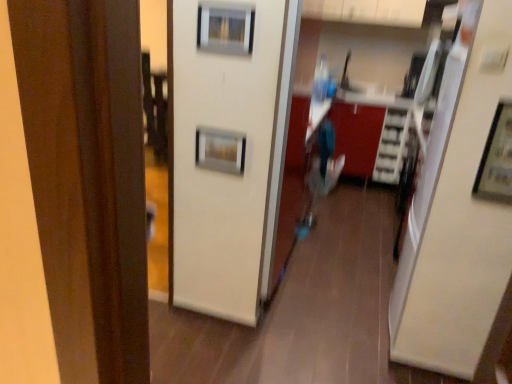
This screenshot has width=512, height=384. What do you see at coordinates (367, 11) in the screenshot?
I see `white glossy cabinet at upper center` at bounding box center [367, 11].

This screenshot has height=384, width=512. What do you see at coordinates (497, 158) in the screenshot?
I see `metallic silver picture frame at upper right, which is the first picture frame from bottom to top` at bounding box center [497, 158].

Where is `metallic silver picture frame at center, the third picture frame viewed from the right`? The width and height of the screenshot is (512, 384). metallic silver picture frame at center, the third picture frame viewed from the right is located at coordinates pyautogui.click(x=220, y=150).

What do you see at coordinates (220, 150) in the screenshot? I see `metallic silver picture frame at center, the second picture frame in the bottom-to-top sequence` at bounding box center [220, 150].

Based on the photo, in order to face metallic silver picture frame at upper center, which ranks as the first picture frame in top-to-bottom order, should I rotate leftwards or rightwards?

It's best to rotate left around 4.050 degrees.

The width and height of the screenshot is (512, 384). I want to click on white glossy cabinet at upper center, so [x=367, y=11].

Based on the photo, looking at their sizes, would you say metallic silver picture frame at upper right, the first picture frame in the front-to-back sequence, is wider or thinner than white glossy cabinet at upper center?

Clearly, metallic silver picture frame at upper right, the first picture frame in the front-to-back sequence, has less width compared to white glossy cabinet at upper center.

Choose the correct answer: Is metallic silver picture frame at upper right, the first picture frame in the front-to-back sequence, inside white glossy cabinet at upper center or outside it?

metallic silver picture frame at upper right, the first picture frame in the front-to-back sequence, is spatially situated outside white glossy cabinet at upper center.

Consider the image. How much distance is there between metallic silver picture frame at upper right, the third picture frame positioned from the back, and white glossy cabinet at upper center?

The distance of metallic silver picture frame at upper right, the third picture frame positioned from the back, from white glossy cabinet at upper center is 2.46 meters.

Is metallic silver picture frame at upper center, the second picture frame in the left-to-right sequence, beside metallic silver picture frame at upper right, which is the 3th picture frame in left-to-right order?

No, metallic silver picture frame at upper center, the second picture frame in the left-to-right sequence, is not next to metallic silver picture frame at upper right, which is the 3th picture frame in left-to-right order.

Considering the sizes of objects metallic silver picture frame at upper center, the 2th picture frame when ordered from front to back, and metallic silver picture frame at upper right, which is the first picture frame from bottom to top, in the image provided, who is thinner, metallic silver picture frame at upper center, the 2th picture frame when ordered from front to back, or metallic silver picture frame at upper right, which is the first picture frame from bottom to top,?

Thinner between the two is metallic silver picture frame at upper center, the 2th picture frame when ordered from front to back.

Based on the photo, is metallic silver picture frame at upper center, the second picture frame in the left-to-right sequence, aimed at metallic silver picture frame at upper right, the third picture frame positioned from the back?

No, metallic silver picture frame at upper center, the second picture frame in the left-to-right sequence, is not facing towards metallic silver picture frame at upper right, the third picture frame positioned from the back.

Relative to metallic silver picture frame at upper right, which is the first picture frame from bottom to top, is metallic silver picture frame at upper center, placed as the 2th picture frame when sorted from right to left, in front or behind?

Clearly, metallic silver picture frame at upper center, placed as the 2th picture frame when sorted from right to left, is behind metallic silver picture frame at upper right, which is the first picture frame from bottom to top.

How many degrees apart are the facing directions of metallic silver picture frame at upper center, the 2th picture frame when ordered from front to back, and white glossy cabinet at upper center?

The angular difference between metallic silver picture frame at upper center, the 2th picture frame when ordered from front to back, and white glossy cabinet at upper center is 1.66 degrees.

Could you tell me if metallic silver picture frame at upper center, placed as the 2th picture frame when sorted from right to left, is turned towards white glossy cabinet at upper center?

No, metallic silver picture frame at upper center, placed as the 2th picture frame when sorted from right to left, is not facing towards white glossy cabinet at upper center.

Do you think metallic silver picture frame at upper center, which ranks as the first picture frame in top-to-bottom order, is within white glossy cabinet at upper center, or outside of it?

metallic silver picture frame at upper center, which ranks as the first picture frame in top-to-bottom order, is outside white glossy cabinet at upper center.

Considering the points (219, 46) and (367, 17), which point is in front, point (219, 46) or point (367, 17)?

The point (219, 46) is closer.

From the image's perspective, which object appears higher, white glossy cabinet at upper center or metallic silver picture frame at center, the second picture frame in the bottom-to-top sequence?

From the image's view, white glossy cabinet at upper center is above.

Which of these two, white glossy cabinet at upper center or metallic silver picture frame at center, the 3th picture frame viewed from the front, is thinner?

Thinner between the two is metallic silver picture frame at center, the 3th picture frame viewed from the front.

In terms of size, does white glossy cabinet at upper center appear bigger or smaller than metallic silver picture frame at center, the second picture frame in the bottom-to-top sequence?

In the image, white glossy cabinet at upper center appears to be larger than metallic silver picture frame at center, the second picture frame in the bottom-to-top sequence.

Locate an element on the screen. The width and height of the screenshot is (512, 384). cabinetry above the metallic silver picture frame at center, the third picture frame viewed from the right (from the image's perspective) is located at coordinates (367, 11).

Considering the positions of points (486, 191) and (244, 163), is point (486, 191) farther from camera compared to point (244, 163)?

No.

Is metallic silver picture frame at upper right, the first picture frame in the front-to-back sequence, looking in the opposite direction of metallic silver picture frame at center, the second picture frame in the bottom-to-top sequence?

No, metallic silver picture frame at upper right, the first picture frame in the front-to-back sequence, is not facing away from metallic silver picture frame at center, the second picture frame in the bottom-to-top sequence.

From the image's perspective, does metallic silver picture frame at upper right, which is the first picture frame from bottom to top, appear lower than metallic silver picture frame at center, the second picture frame in the bottom-to-top sequence?

Answer: Yes.

Considering their positions, is white glossy cabinet at upper center located in front of or behind metallic silver picture frame at upper center, placed as the second picture frame when sorted from back to front?

white glossy cabinet at upper center is behind metallic silver picture frame at upper center, placed as the second picture frame when sorted from back to front.

From a real-world perspective, is white glossy cabinet at upper center physically located above or below metallic silver picture frame at upper center, placed as the 2th picture frame when sorted from right to left?

In terms of real-world spatial position, white glossy cabinet at upper center is above metallic silver picture frame at upper center, placed as the 2th picture frame when sorted from right to left.

Between white glossy cabinet at upper center and metallic silver picture frame at upper center, placed as the 2th picture frame when sorted from right to left, which one has larger size?

white glossy cabinet at upper center.

Between metallic silver picture frame at upper center, the 3th picture frame in the bottom-to-top sequence, and metallic silver picture frame at center, the third picture frame viewed from the right, which one has smaller width?

With smaller width is metallic silver picture frame at center, the third picture frame viewed from the right.

Is metallic silver picture frame at upper center, the 2th picture frame when ordered from front to back, oriented away from metallic silver picture frame at center, the 1th picture frame when ordered from left to right?

No, metallic silver picture frame at center, the 1th picture frame when ordered from left to right, is not at the back of metallic silver picture frame at upper center, the 2th picture frame when ordered from front to back.

Based on the photo, considering the positions of objects metallic silver picture frame at upper center, the 2th picture frame when ordered from front to back, and metallic silver picture frame at center, the second picture frame in the bottom-to-top sequence, in the image provided, who is more to the left, metallic silver picture frame at upper center, the 2th picture frame when ordered from front to back, or metallic silver picture frame at center, the second picture frame in the bottom-to-top sequence,?

Positioned to the left is metallic silver picture frame at center, the second picture frame in the bottom-to-top sequence.

Considering the relative positions of metallic silver picture frame at upper center, placed as the second picture frame when sorted from back to front, and metallic silver picture frame at center, which is counted as the first picture frame, starting from the back, in the image provided, is metallic silver picture frame at upper center, placed as the second picture frame when sorted from back to front, in front of metallic silver picture frame at center, which is counted as the first picture frame, starting from the back,?

Yes, the depth of metallic silver picture frame at upper center, placed as the second picture frame when sorted from back to front, is less than that of metallic silver picture frame at center, which is counted as the first picture frame, starting from the back.

Which picture frame is the 1st one when counting from the left side of the white glossy cabinet at upper center? Please provide its 2D coordinates.

[(497, 158)]

From the image's perspective, starting from the metallic silver picture frame at upper center, the 3th picture frame in the bottom-to-top sequence, which picture frame is the 2nd one below? Please provide its 2D coordinates.

[(497, 158)]

When comparing their distances from metallic silver picture frame at upper right, the first picture frame in the front-to-back sequence, does white glossy cabinet at upper center or metallic silver picture frame at upper center, the 3th picture frame in the bottom-to-top sequence, seem further?

The object further to metallic silver picture frame at upper right, the first picture frame in the front-to-back sequence, is white glossy cabinet at upper center.

Looking at the image, which one is located closer to metallic silver picture frame at center, the 1th picture frame when ordered from left to right, metallic silver picture frame at upper right, which is the first picture frame from bottom to top, or metallic silver picture frame at upper center, placed as the second picture frame when sorted from back to front?

metallic silver picture frame at upper center, placed as the second picture frame when sorted from back to front.

Estimate the real-world distances between objects in this image. Which object is further from metallic silver picture frame at upper center, which ranks as the first picture frame in top-to-bottom order, metallic silver picture frame at upper right, the 1th picture frame in the right-to-left sequence, or metallic silver picture frame at center, the second picture frame in the bottom-to-top sequence?

metallic silver picture frame at upper right, the 1th picture frame in the right-to-left sequence, is positioned further to the anchor metallic silver picture frame at upper center, which ranks as the first picture frame in top-to-bottom order.

Based on their spatial positions, is metallic silver picture frame at center, the 2th picture frame in the top-to-bottom sequence, or metallic silver picture frame at upper center, the 2th picture frame when ordered from front to back, closer to white glossy cabinet at upper center?

Based on the image, metallic silver picture frame at upper center, the 2th picture frame when ordered from front to back, appears to be nearer to white glossy cabinet at upper center.

When comparing their distances from metallic silver picture frame at center, the third picture frame viewed from the right, does metallic silver picture frame at upper center, the second picture frame in the left-to-right sequence, or metallic silver picture frame at upper right, which is the 3th picture frame in left-to-right order, seem further?

metallic silver picture frame at upper right, which is the 3th picture frame in left-to-right order, lies further to metallic silver picture frame at center, the third picture frame viewed from the right, than the other object.

Looking at this image, which object lies further to the anchor point metallic silver picture frame at upper center, the 3th picture frame in the bottom-to-top sequence, white glossy cabinet at upper center or metallic silver picture frame at center, the 2th picture frame in the top-to-bottom sequence?

Based on the image, white glossy cabinet at upper center appears to be further to metallic silver picture frame at upper center, the 3th picture frame in the bottom-to-top sequence.

Looking at the image, which one is located closer to metallic silver picture frame at upper center, which ranks as the first picture frame in top-to-bottom order, metallic silver picture frame at center, the 2th picture frame in the top-to-bottom sequence, or metallic silver picture frame at upper right, which is the 3th picture frame in left-to-right order?

metallic silver picture frame at center, the 2th picture frame in the top-to-bottom sequence, lies closer to metallic silver picture frame at upper center, which ranks as the first picture frame in top-to-bottom order, than the other object.

From the image, which object appears to be farther from metallic silver picture frame at upper right, which is the 3th picture frame in left-to-right order, metallic silver picture frame at center, the 2th picture frame in the top-to-bottom sequence, or white glossy cabinet at upper center?

The object further to metallic silver picture frame at upper right, which is the 3th picture frame in left-to-right order, is white glossy cabinet at upper center.

What are the coordinates of `picture frame between metallic silver picture frame at center, the 2th picture frame in the top-to-bottom sequence, and metallic silver picture frame at upper right, which is the 3th picture frame in left-to-right order` in the screenshot? It's located at (225, 29).

Where is `picture frame between metallic silver picture frame at upper center, placed as the second picture frame when sorted from back to front, and white glossy cabinet at upper center, along the z-axis`? The height and width of the screenshot is (384, 512). picture frame between metallic silver picture frame at upper center, placed as the second picture frame when sorted from back to front, and white glossy cabinet at upper center, along the z-axis is located at coordinates (220, 150).